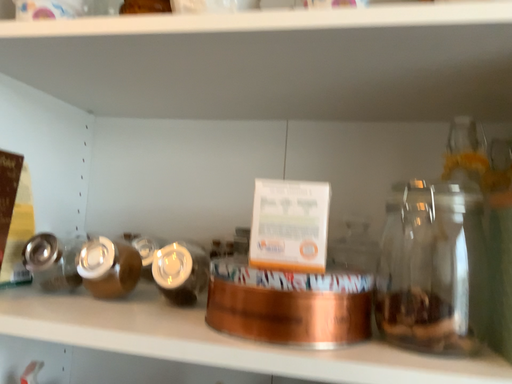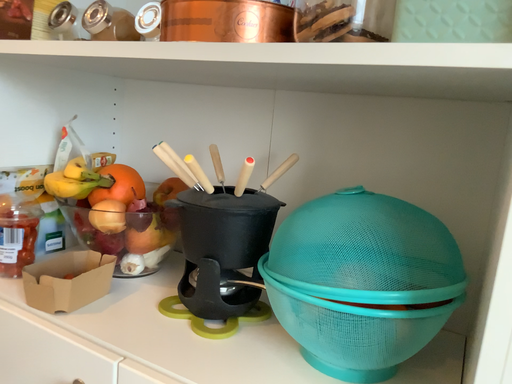
Question: How did the camera likely rotate when shooting the video?

Choices:
 (A) rotated left
 (B) rotated right

Answer: (A)